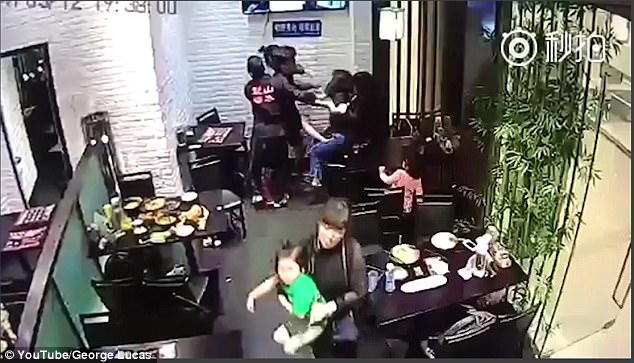
You are a GUI agent. You are given a task and a screenshot of the screen. Output one action in this format:
    pyautogui.click(x=<x>, y=<y>)
    Task: Click on the plant
    The image size is (634, 363).
    Given the screenshot: What is the action you would take?
    pyautogui.click(x=540, y=137)